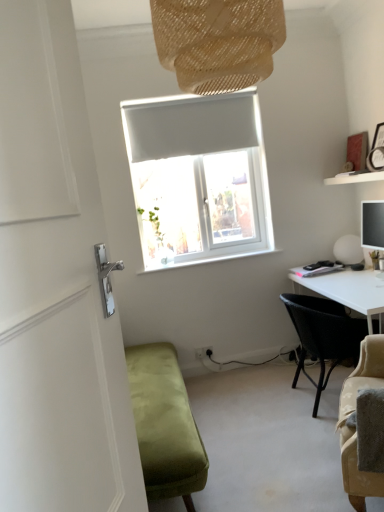
Question: Looking at their shapes, would you say white glossy door handle at left is wider or thinner than white matte sphere at right?

Choices:
 (A) wide
 (B) thin

Answer: (B)

Question: Visually, is white glossy door handle at left positioned to the left or to the right of white matte sphere at right?

Choices:
 (A) right
 (B) left

Answer: (B)

Question: Estimate the real-world distances between objects in this image. Which object is farther from the white matte shelf at upper right?

Choices:
 (A) brown woven lampshade at upper center
 (B) white glossy door handle at left
 (C) velvet green bench at lower left
 (D) white matte sphere at right
 (E) black woven chair at right

Answer: (B)

Question: Which object is positioned farthest from the brown woven lampshade at upper center?

Choices:
 (A) velvet green bench at lower left
 (B) white glossy door handle at left
 (C) white matte sphere at right
 (D) white matte shelf at upper right
 (E) black woven chair at right

Answer: (C)